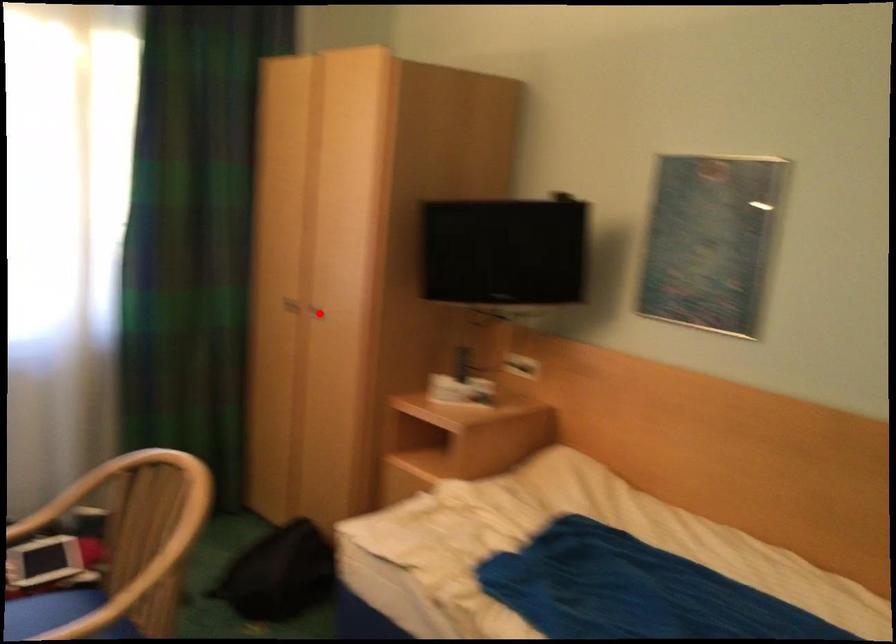
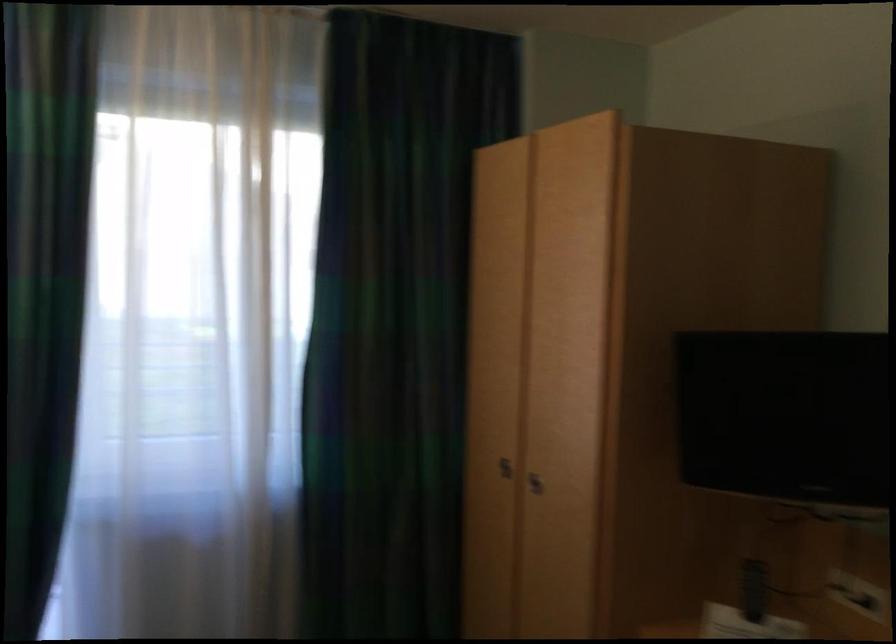
Question: A red point is marked in image1. In image2, is the corresponding 3D point closer to the camera or farther? Reply with the corresponding letter.

Choices:
 (A) The corresponding 3D point is closer.
 (B) The corresponding 3D point is farther.

Answer: (A)